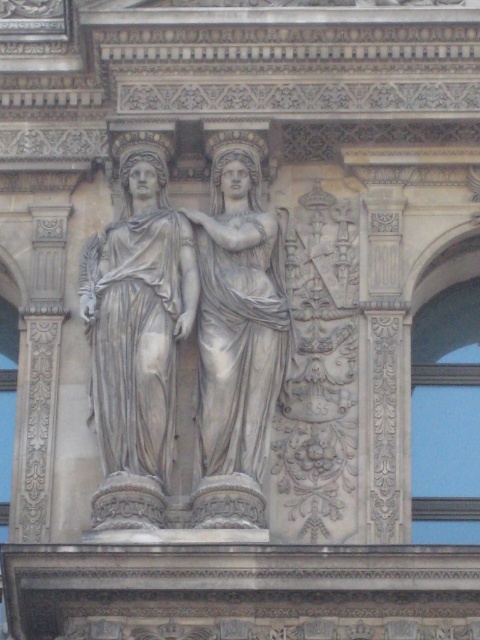
Can you confirm if gray marble statue at center is positioned to the right of white marble statue at center?

No, gray marble statue at center is not to the right of white marble statue at center.

Is gray marble statue at center bigger than white marble statue at center?

Correct, gray marble statue at center is larger in size than white marble statue at center.

Locate an element on the screen. The height and width of the screenshot is (640, 480). gray marble statue at center is located at coordinates (137, 320).